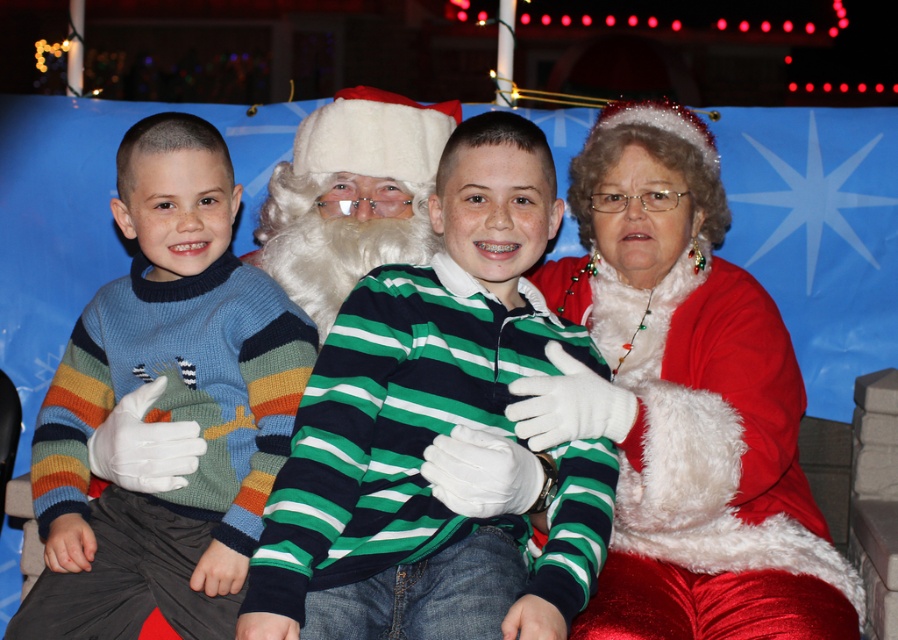
You are trying to decide which item is larger in width between the green striped sweater at center and the white fluffy beard at center. Based on the scene, which one is wider?

The green striped sweater at center is wider than the white fluffy beard at center according to the description.

You are standing in front of the festive scene and want to place a small gift exactly halfway between the two points marked as point (709, 307) and point (405, 131). Will the gift be closer to the foreground or background of the image?

The gift placed halfway between point (709, 307) and point (405, 131) will be closer to the foreground because point (709, 307) is closer to the viewer than point (405, 131), so the midpoint leans towards the foreground.